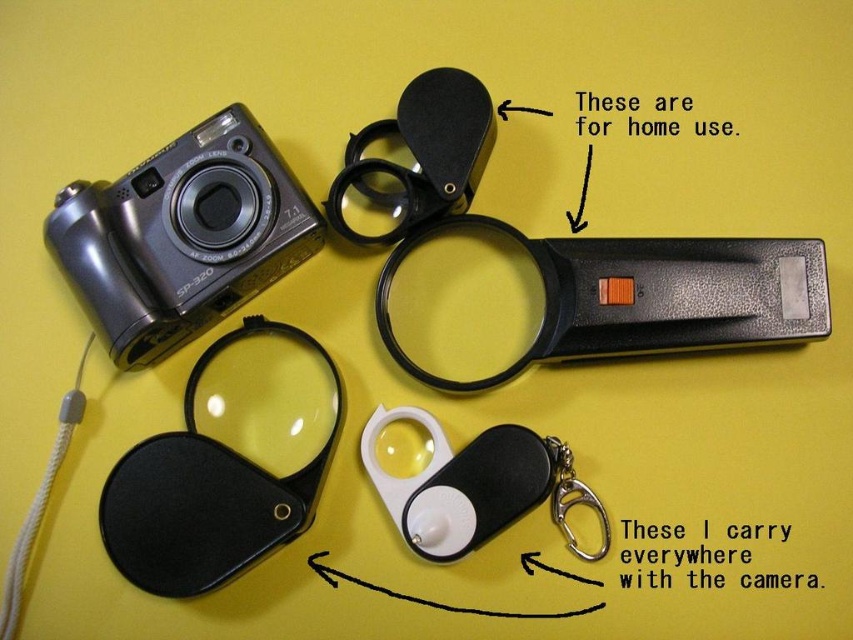
You are a photographer setting up equipment on a yellow background. You need to place a matte black camera at upper left and a black matte lens filter at lower left. The camera must be at least 20 centimeters away from the lens filter to avoid interference. Based on the current setup, is the distance sufficient?

The distance between the matte black camera at upper left and the black matte lens filter at lower left is 18.25 centimeters, which is less than the required 20 centimeters. Therefore, the current setup does not meet the distance requirement.

You are organizing a display for optical accessories. You need to place the matte black camera at upper left and the black matte lens filter at lower left on a shelf. Which object requires a wider space on the shelf?

The matte black camera at upper left requires a wider space on the shelf because its width surpasses that of the black matte lens filter at lower left.

What is the position of the black matte lens filter at lower left in the image?

The black matte lens filter at lower left is located at point 0.775 on the x axis and 0.242 on the y axis.